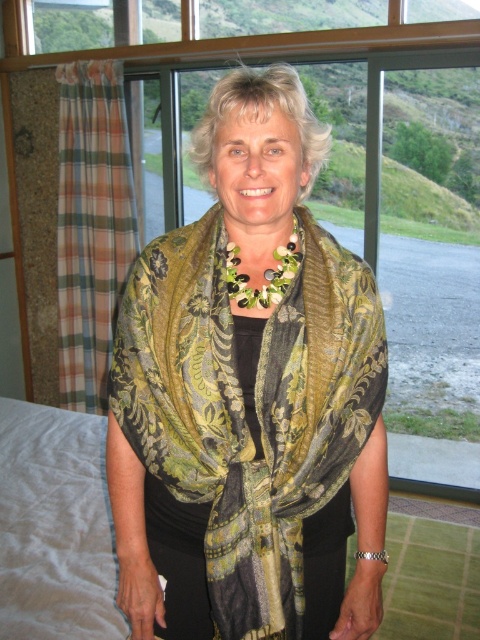
You are a fashion designer observing the image. You see the green floral silk scarf at center and the green floral fabric at center. Which one is bigger in size?

The green floral silk scarf at center is larger in size than the green floral fabric at center.

From the picture: You are a photographer composing a portrait of the person in the scene. The subject is wearing a green floral silk scarf at center. To ensure the scarf is in the ideal focal point, where should you place it in the frame according to the rule of thirds grid?

According to the rule of thirds grid, the ideal focal point would be at one of the intersection points. Since the green floral silk scarf at center is located at coordinate point (245, 410), it aligns closely with the right intersection point of the rule of thirds grid. Therefore, positioning the scarf at this point would create a balanced and visually appealing composition.